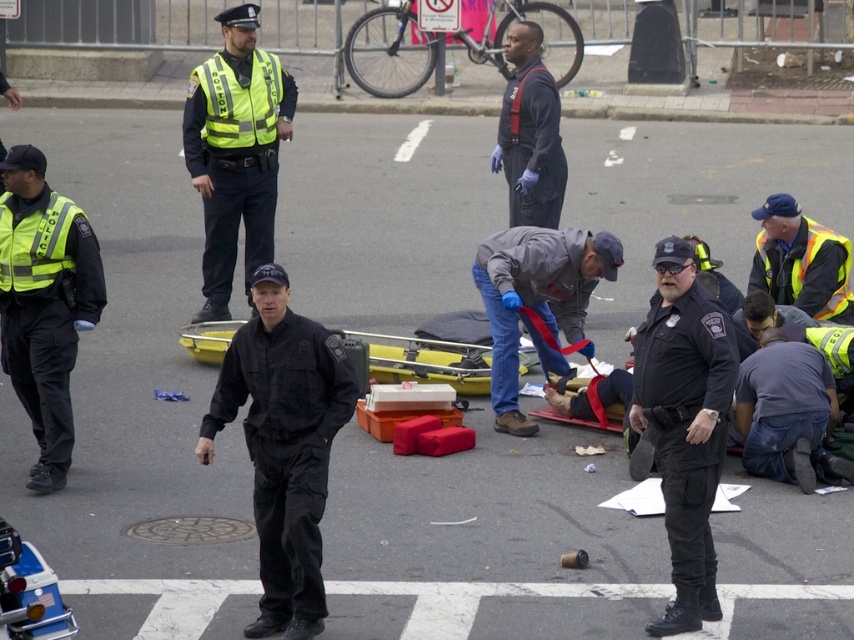
You are a pedestrian on the street and notice the reflective yellow vest at upper left and the gray fabric jacket at center. Which one is bigger in size?

The reflective yellow vest at upper left has a larger size compared to the gray fabric jacket at center.

You are a pedestrian standing at the center of the crosswalk. You notice a reflective yellow vest at left. Based on its position, can you estimate where exactly it is located relative to your current position?

The reflective yellow vest at left is located at the lower left position relative to your current position at the center of the crosswalk.